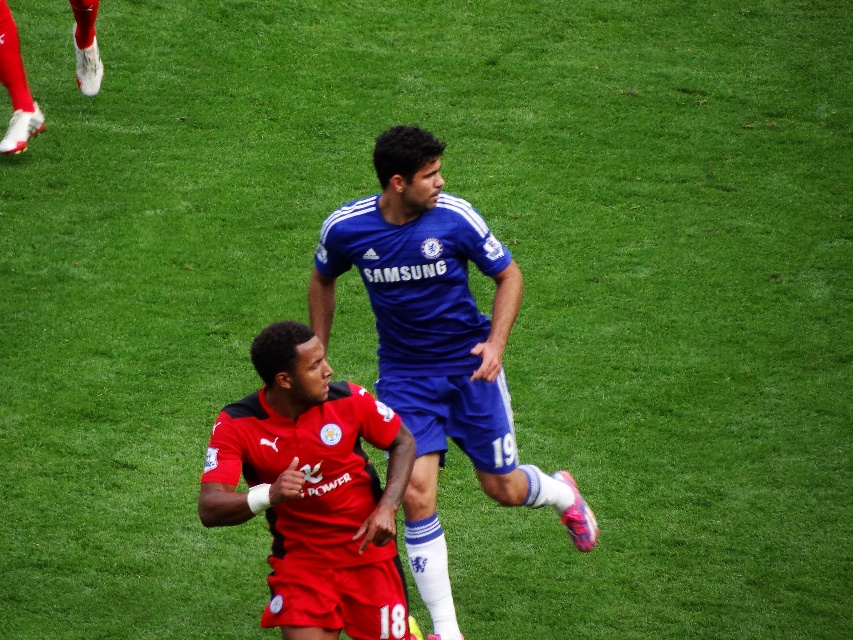
Is blue fabric soccer player at center wider than blue jersey at center?

Indeed, blue fabric soccer player at center has a greater width compared to blue jersey at center.

Is blue fabric soccer player at center in front of blue jersey at center?

Yes, blue fabric soccer player at center is closer to the viewer.

In order to click on blue fabric soccer player at center in this screenshot , I will do `click(437, 346)`.

Which is above, red jersey at center or blue jersey at center?

blue jersey at center

Between point (231, 410) and point (410, 355), which one is positioned behind?

The point (410, 355) is behind.

Is point (280, 448) less distant than point (361, 204)?

That is True.

Where is `red jersey at center`? red jersey at center is located at coordinates (312, 490).

Which is above, blue fabric soccer player at center or red jersey at center?

Positioned higher is blue fabric soccer player at center.

Is blue fabric soccer player at center taller than red jersey at center?

Correct, blue fabric soccer player at center is much taller as red jersey at center.

The height and width of the screenshot is (640, 853). Find the location of `blue fabric soccer player at center`. blue fabric soccer player at center is located at coordinates (437, 346).